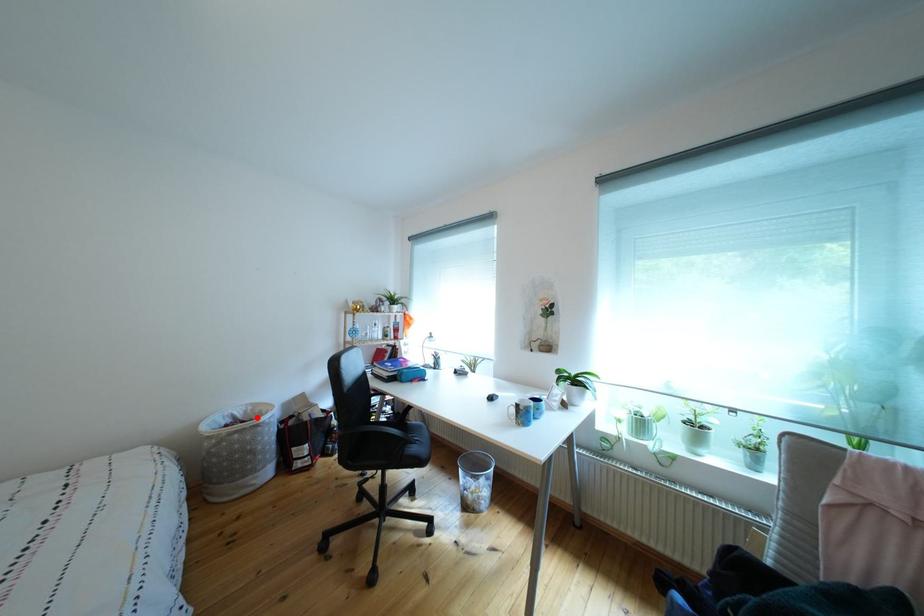
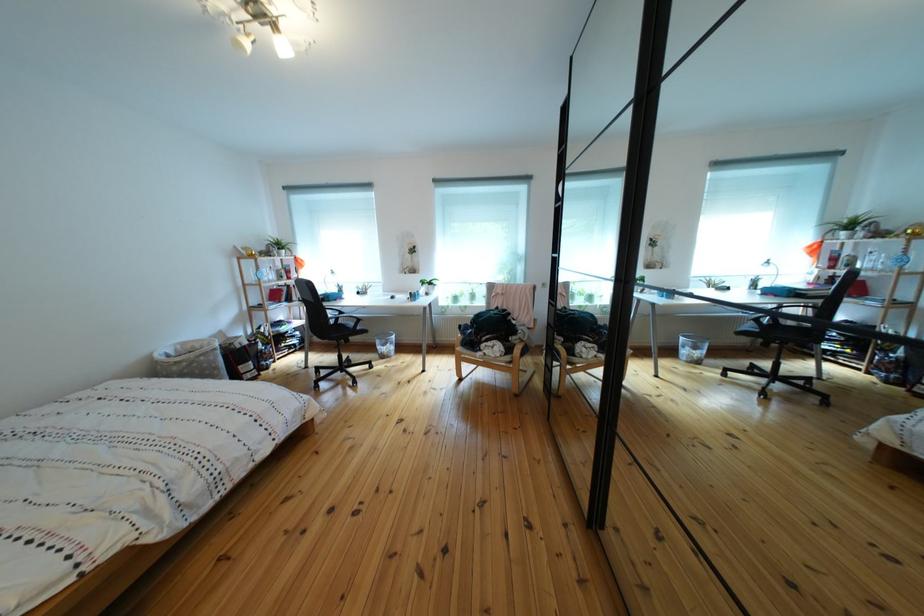
Where in the second image is the point corresponding to the highlighted location from the first image?

(187, 355)